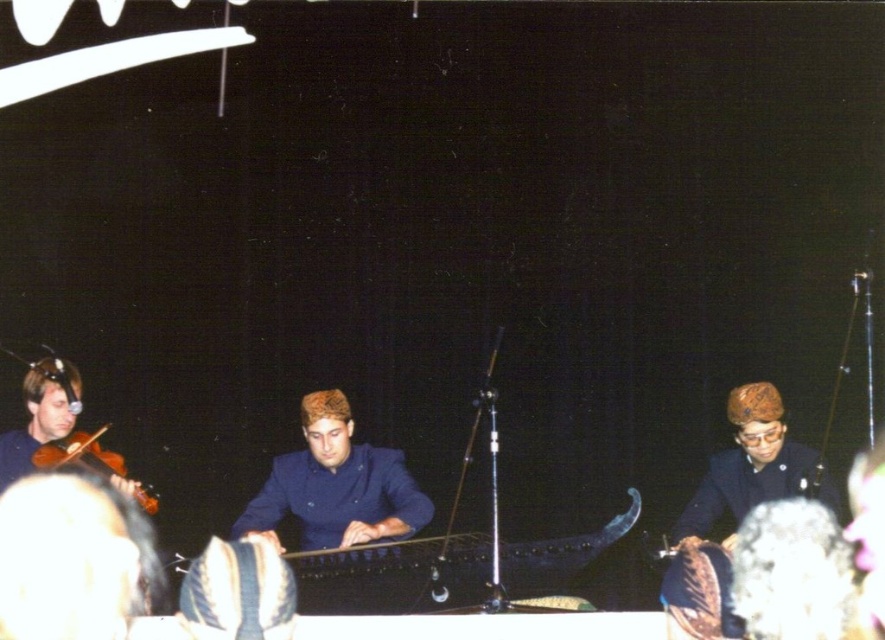
Question: Which object appears farthest from the camera in this image?

Choices:
 (A) matte brown violin at left
 (B) dark blue fabric at center
 (C) dark blue uniform at center

Answer: (A)

Question: Can you confirm if dark blue fabric at center is positioned to the left of dark blue uniform at center?

Choices:
 (A) no
 (B) yes

Answer: (B)

Question: From the image, what is the correct spatial relationship of dark blue uniform at center in relation to matte brown violin at left?

Choices:
 (A) below
 (B) above

Answer: (A)

Question: Which object is positioned farthest from the dark blue fabric at center?

Choices:
 (A) dark blue uniform at center
 (B) matte brown violin at left

Answer: (A)

Question: Does dark blue fabric at center appear on the left side of dark blue uniform at center?

Choices:
 (A) no
 (B) yes

Answer: (B)

Question: Among these objects, which one is farthest from the camera?

Choices:
 (A) dark blue uniform at center
 (B) matte brown violin at left

Answer: (B)